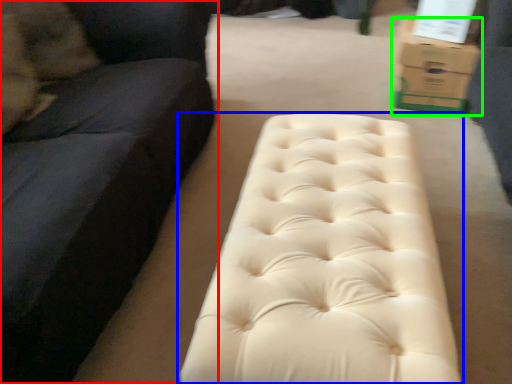
Question: Estimate the real-world distances between objects in this image. Which object is farther from studio couch (highlighted by a red box), furniture (highlighted by a blue box) or cardboard box (highlighted by a green box)?

Choices:
 (A) furniture
 (B) cardboard box

Answer: (B)